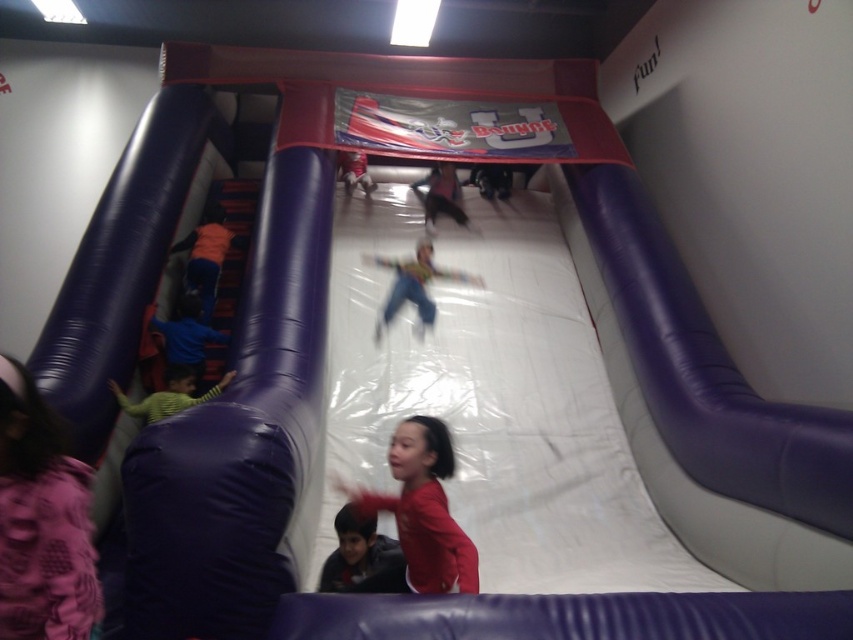
Question: Does orange fabric pants at left have a lesser width compared to green striped shirt at left?

Choices:
 (A) no
 (B) yes

Answer: (B)

Question: Which of the following is the farthest from the observer?

Choices:
 (A) matte red shirt at center
 (B) green striped shirt at left
 (C) blue fabric child at left
 (D) orange fabric pants at left

Answer: (D)

Question: Which object is closer to the camera taking this photo?

Choices:
 (A) matte blue jumpsuit at center
 (B) green striped shirt at left
 (C) matte purple dress at lower left

Answer: (C)

Question: Can you confirm if matte blue jumpsuit at center is positioned below orange fabric pants at left?

Choices:
 (A) yes
 (B) no

Answer: (A)

Question: In this image, where is dark blue fabric child at lower center located relative to orange fabric pants at left?

Choices:
 (A) below
 (B) above

Answer: (A)

Question: Which of the following is the farthest from the observer?

Choices:
 (A) (204, 252)
 (B) (439, 528)
 (C) (396, 307)
 (D) (200, 305)

Answer: (A)